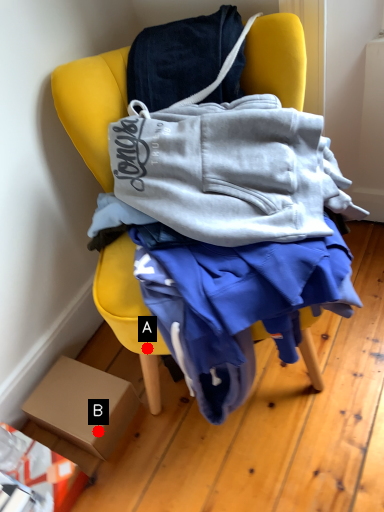
Question: Two points are circled on the image, labeled by A and B beside each circle. Which point appears farthest from the camera in this image?

Choices:
 (A) A is further
 (B) B is further

Answer: (B)